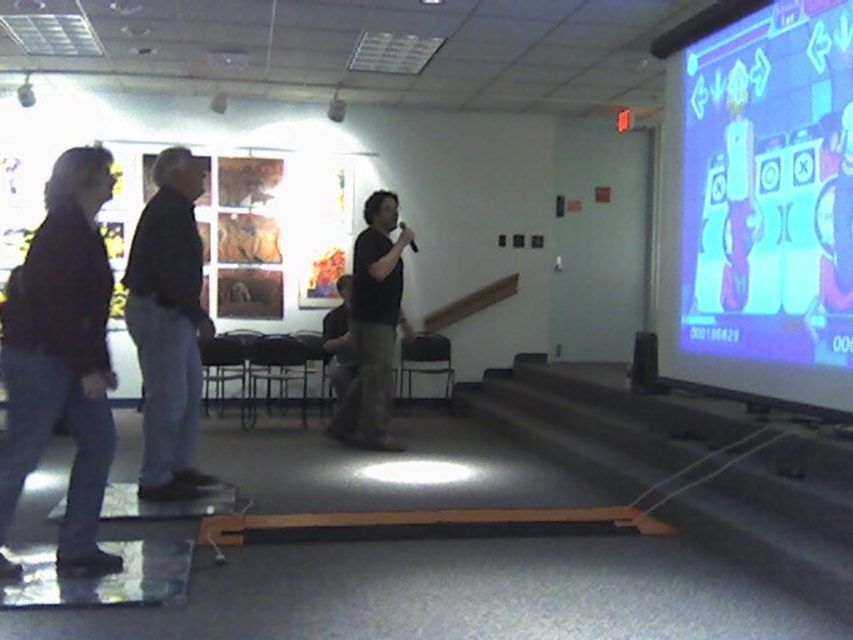
You are organizing a small event in this room and need to place a 10 feet long banner between the matte blue screen at upper right and the dark brown leather jacket at left. Is there enough space for the banner to fit horizontally between them?

The distance between the matte blue screen at upper right and the dark brown leather jacket at left is 11.14 feet, which is longer than the 10 feet banner. Therefore, there is enough space to place the banner horizontally between them.

Looking at this image, you are organizing a clothing donation drive and need to arrange these two shirts based on their position in the image. Since the black cotton shirt at left is positioned to the left of the black matte shirt at center, which shirt should you place first on the donation rack from left to right?

The black cotton shirt at left should be placed first on the donation rack from left to right since it is positioned to the left of the black matte shirt at center in the image.

You are a photographer setting up a shoot in this room. You need to position the matte blue screen at upper right so that it is visible in the background behind the black matte shirt at center. Is the current arrangement correct?

Yes, the current arrangement is correct because the matte blue screen at upper right is already positioned in front of the black matte shirt at center, making it visible in the background.